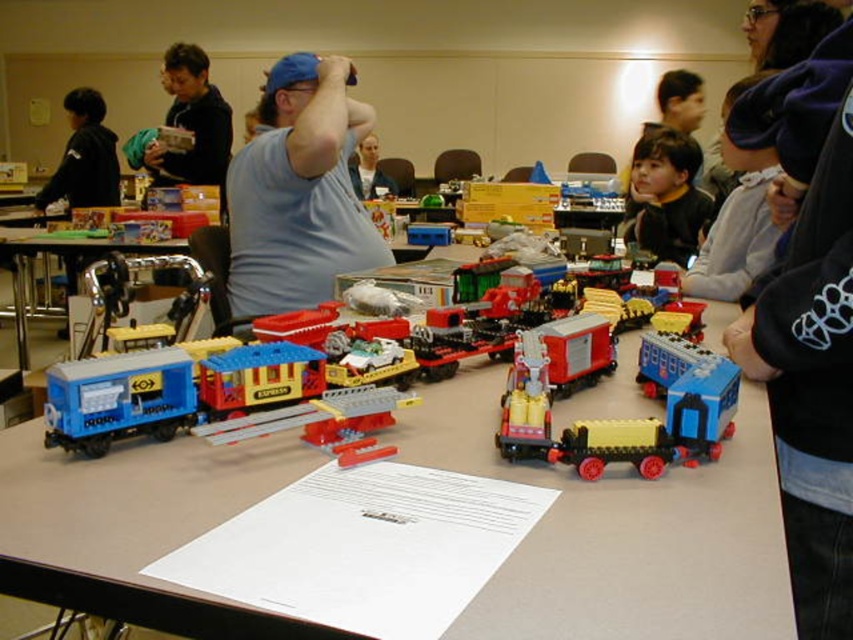
Question: Can you confirm if white paper at center is positioned to the right of brushed metal box at upper left?

Choices:
 (A) yes
 (B) no

Answer: (A)

Question: Is brushed metal box at upper left below black jacket at left?

Choices:
 (A) no
 (B) yes

Answer: (B)

Question: Which object is positioned farthest from the matte plastic train car at center?

Choices:
 (A) matte blue shirt at center
 (B) matte blue plastic train car at lower left
 (C) blue cotton shirt at center

Answer: (A)

Question: Among these points, which one is nearest to the camera?

Choices:
 (A) (668, 74)
 (B) (51, 186)

Answer: (B)

Question: Among these points, which one is farthest from the camera?

Choices:
 (A) (357, 157)
 (B) (699, 116)
 (C) (737, 419)

Answer: (A)

Question: Can you confirm if brown hair at upper center is bigger than brushed metal box at upper left?

Choices:
 (A) yes
 (B) no

Answer: (B)